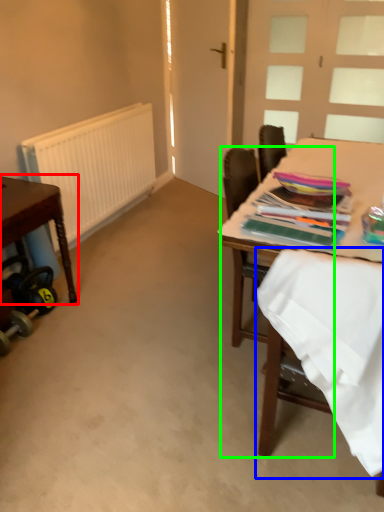
Question: Estimate the real-world distances between objects in this image. Which object is farther from table (highlighted by a red box), fabric (highlighted by a blue box) or chair (highlighted by a green box)?

Choices:
 (A) fabric
 (B) chair

Answer: (A)